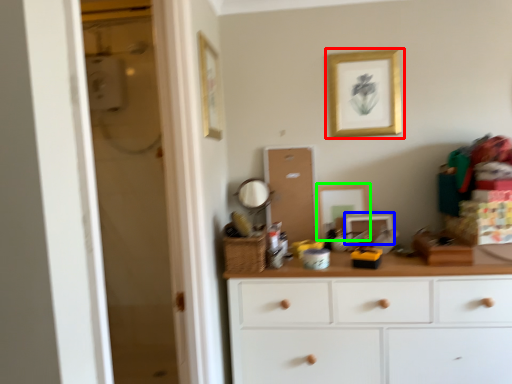
Question: Estimate the real-world distances between objects in this image. Which object is closer to picture frame (highlighted by a red box), picture frame (highlighted by a blue box) or picture frame (highlighted by a green box)?

Choices:
 (A) picture frame
 (B) picture frame

Answer: (B)